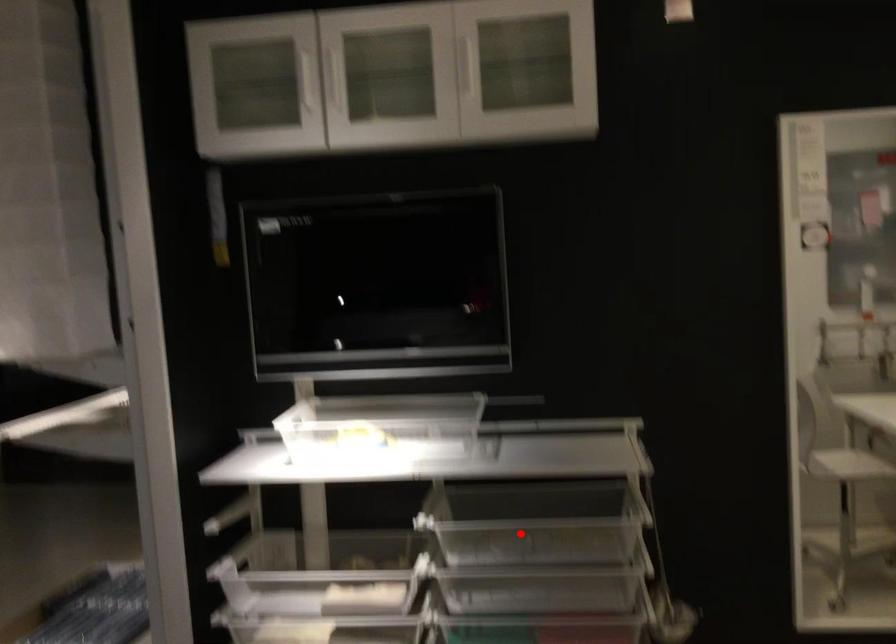
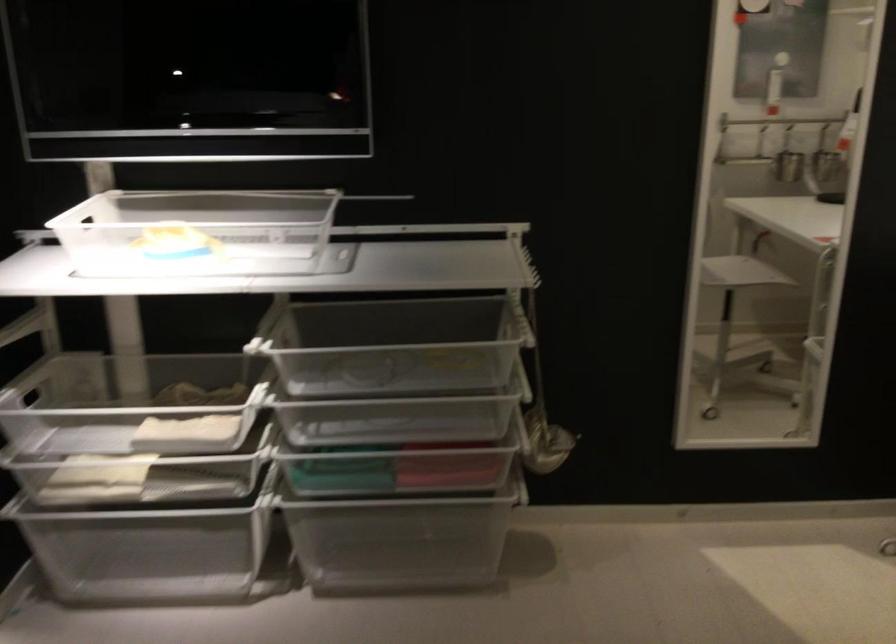
Question: I am providing you with two images of the same scene from different viewpoints. In image1, a red point is highlighted. Considering the same 3D point in image2, which of the following is correct?

Choices:
 (A) It is closer
 (B) It is farther

Answer: (A)